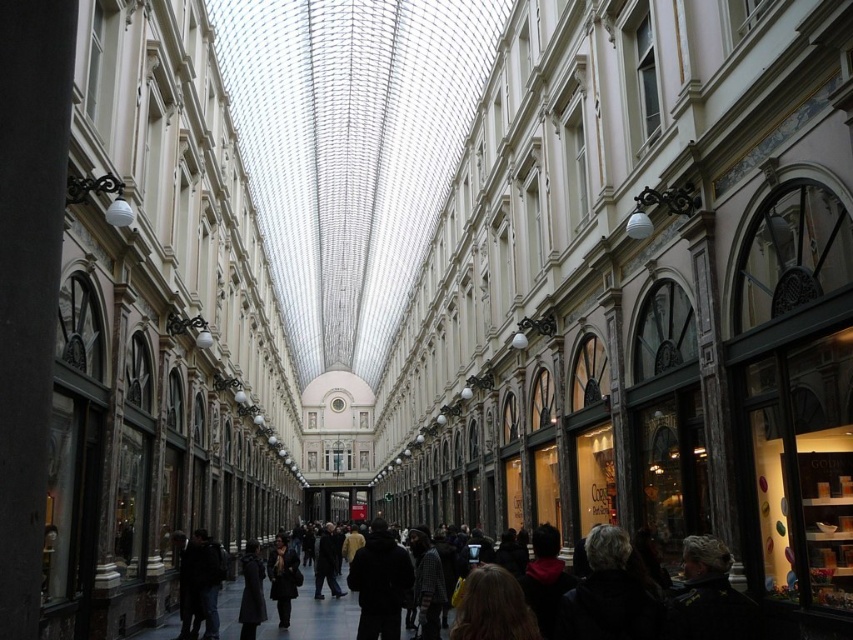
Question: Which of the following is the farthest from the observer?

Choices:
 (A) dark gray wool coat at center
 (B) dark woolen coat at center

Answer: (A)

Question: Can you confirm if dark woolen coat at center is positioned to the right of dark gray wool coat at center?

Choices:
 (A) yes
 (B) no

Answer: (A)

Question: Which object appears farthest from the camera in this image?

Choices:
 (A) dark gray wool coat at center
 (B) dark woolen coat at center

Answer: (A)

Question: Can you confirm if dark woolen coat at center is wider than dark gray wool coat at center?

Choices:
 (A) no
 (B) yes

Answer: (B)

Question: Can you confirm if dark woolen coat at center is smaller than dark gray wool coat at center?

Choices:
 (A) no
 (B) yes

Answer: (B)